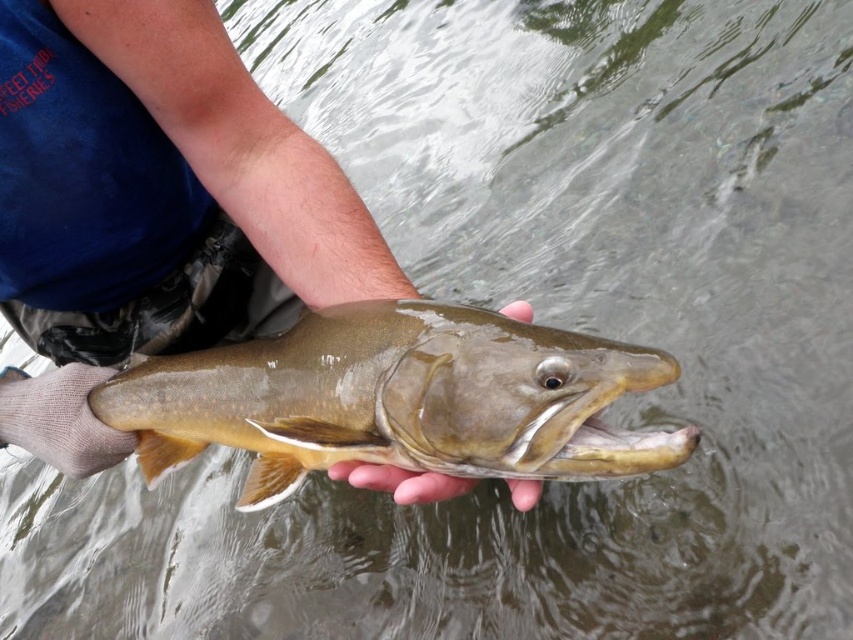
Between point (415, 484) and point (383, 483), which one is positioned in front?

Point (415, 484)

Can you confirm if smooth brown fish at center is thinner than smooth skin hand at center?

Incorrect, smooth brown fish at center's width is not less than smooth skin hand at center's.

Does point (508, 307) lie behind point (345, 461)?

Yes.

Where is `smooth brown fish at center`? This screenshot has width=853, height=640. smooth brown fish at center is located at coordinates (401, 481).

Between point (276, 416) and point (354, 465), which one is positioned behind?

The point (276, 416) is more distant.

Identify the location of shiny brown fish at center. This screenshot has height=640, width=853. (396, 397).

How far apart are shiny brown fish at center and smooth brown fish at center?

They are 4.52 inches apart.

Does shiny brown fish at center appear over smooth brown fish at center?

No, shiny brown fish at center is not above smooth brown fish at center.

Which is in front, point (585, 468) or point (361, 477)?

Point (585, 468) is in front.

This screenshot has width=853, height=640. I want to click on shiny brown fish at center, so click(x=396, y=397).